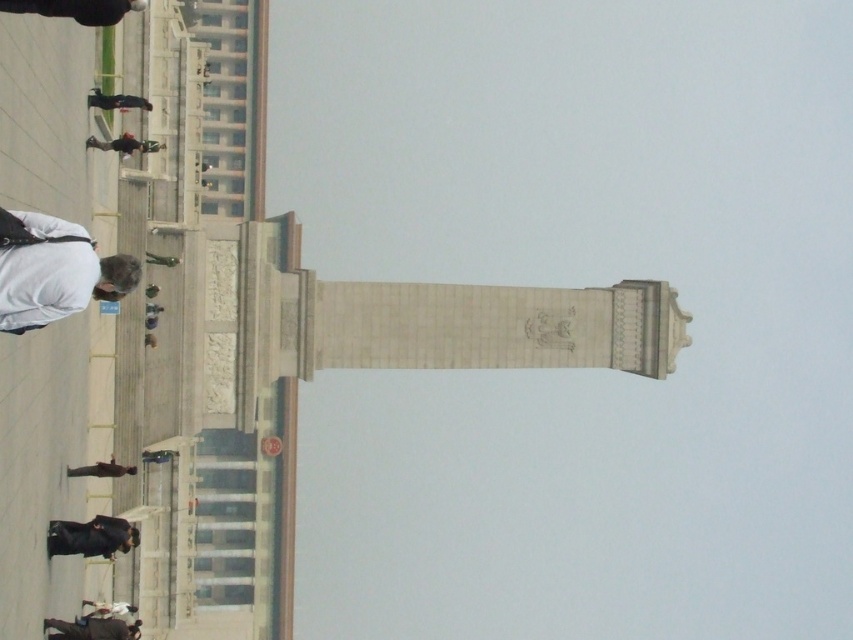
Describe the element at coordinates (125, 145) in the screenshot. I see `black matte skateboard at center` at that location.

Does point (97, 145) come closer to viewer compared to point (73, 468)?

That is False.

Is point (88, 141) positioned behind point (122, 472)?

Yes, it is.

This screenshot has width=853, height=640. Find the location of `black matte skateboard at center`. black matte skateboard at center is located at coordinates (125, 145).

Which is in front, point (155, 198) or point (91, 544)?

Point (91, 544)

Where is `white stone tower at center`? white stone tower at center is located at coordinates (207, 333).

How far apart are white matte skateboard at lower left and green fabric person at lower left?

white matte skateboard at lower left is 19.92 meters from green fabric person at lower left.

Is point (32, 244) in front of point (158, 260)?

Yes, point (32, 244) is in front of point (158, 260).

Where is `white matte skateboard at lower left`? white matte skateboard at lower left is located at coordinates (54, 272).